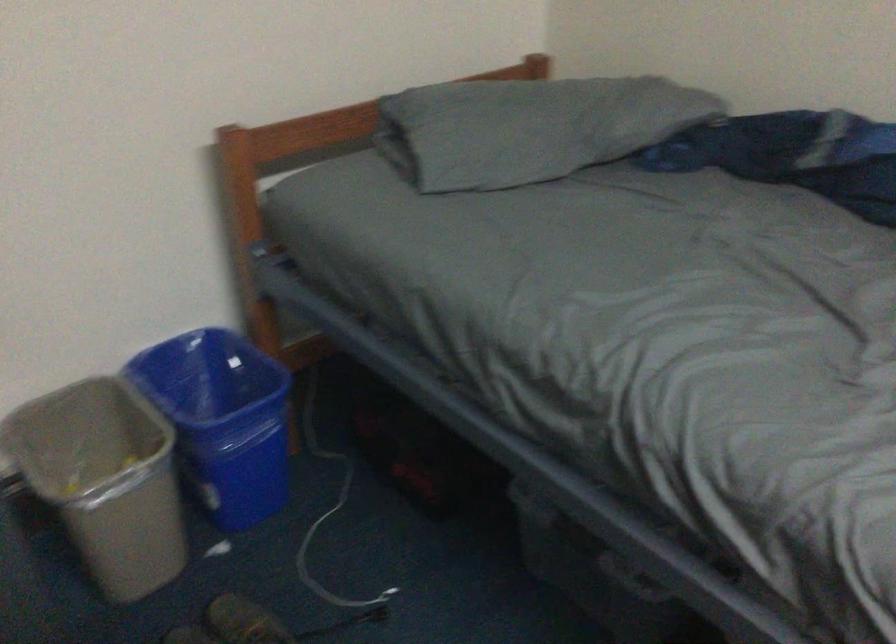
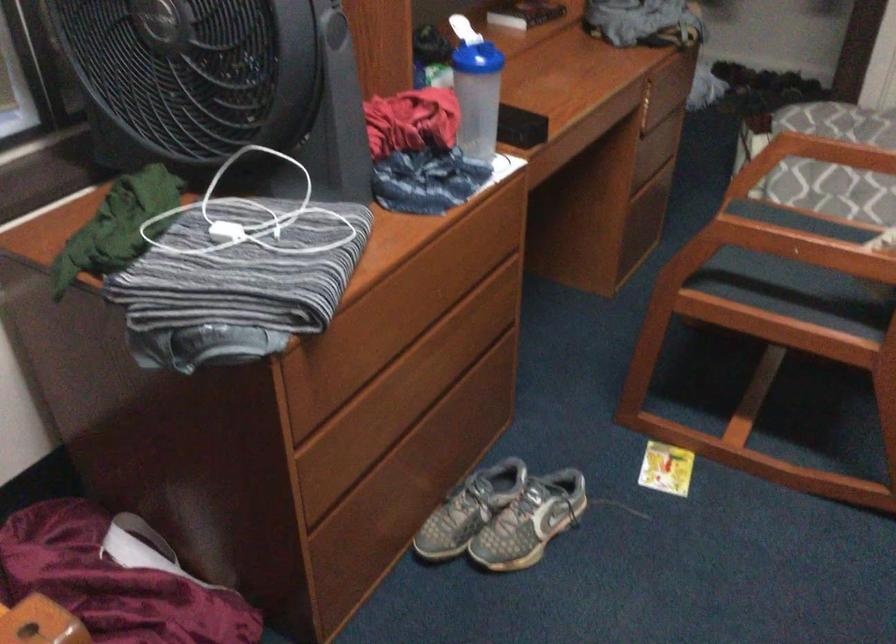
First-person continuous shooting, in which direction is the camera rotating?

The camera rotated toward right-down.